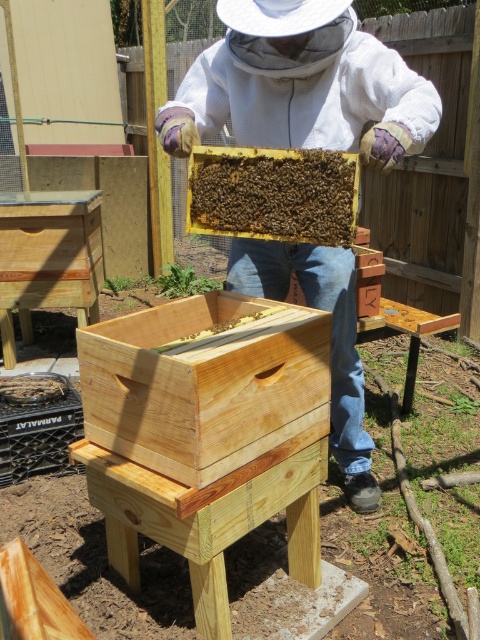
Which is in front, point (411, 141) or point (254, 211)?

Positioned in front is point (411, 141).

Can you confirm if white fabric beekeeper suit at center is thinner than brown wooden beehive at center?

No.

At what (x,y) coordinates should I click in order to perform the action: click on white fabric beekeeper suit at center. Please return your answer as a coordinate pair (x, y). Looking at the image, I should click on (300, 84).

Is natural wood beehive at center above brown wooden beehive at center?

Incorrect, natural wood beehive at center is not positioned above brown wooden beehive at center.

Does natural wood beehive at center come in front of brown wooden beehive at center?

Yes.

Does point (131, 376) lie behind point (262, 148)?

No, (131, 376) is closer to viewer.

Image resolution: width=480 pixels, height=640 pixels. What are the coordinates of `natural wood beehive at center` in the screenshot? It's located at (204, 384).

Does natural wood beehive at center have a larger size compared to brown wooden bee at center?

Yes, natural wood beehive at center is bigger than brown wooden bee at center.

Is natural wood beehive at center taller than brown wooden bee at center?

Indeed, natural wood beehive at center has a greater height compared to brown wooden bee at center.

Does point (227, 410) come closer to viewer compared to point (204, 330)?

Yes, it is in front of point (204, 330).

Locate an element on the screen. This screenshot has width=480, height=640. natural wood beehive at center is located at coordinates (204, 384).